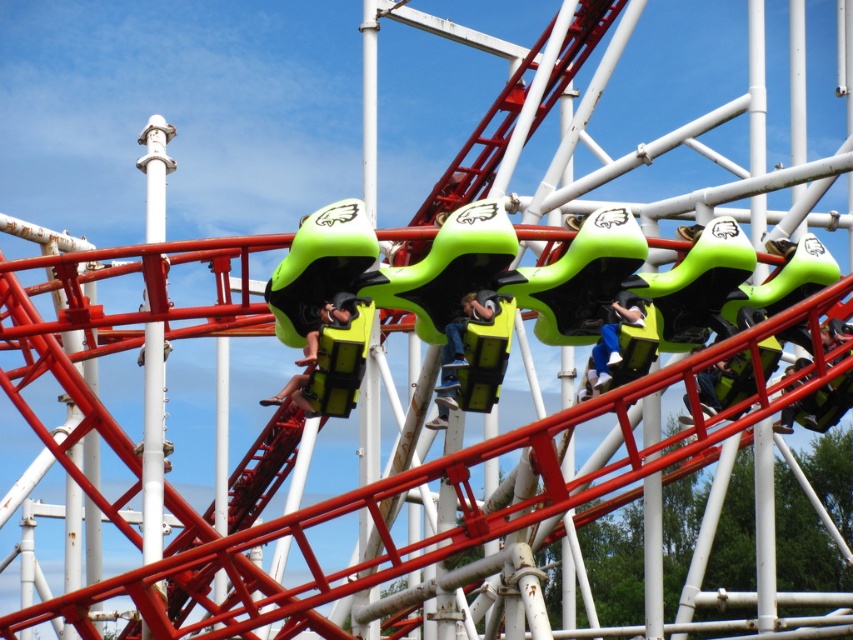
Can you confirm if green matte seat at center is shorter than yellow-green fabric safety vest at center?

In fact, green matte seat at center may be taller than yellow-green fabric safety vest at center.

Does green matte seat at center have a greater height compared to yellow-green fabric safety vest at center?

Yes, green matte seat at center is taller than yellow-green fabric safety vest at center.

Measure the distance between green matte seat at center and camera.

217.40 feet

Find the location of a particular element. green matte seat at center is located at coordinates (412, 282).

Consider the image. Is yellow-green plastic helmet at center positioned at the back of yellow-green fabric safety vest at center?

Yes.

Between yellow-green plastic helmet at center and yellow-green fabric safety vest at center, which one is positioned higher?

yellow-green plastic helmet at center is above.

Is point (451, 376) in front of point (326, 301)?

No, it is not.

Locate an element on the screen. yellow-green plastic helmet at center is located at coordinates (460, 349).

Which is more to the left, green matte seat at center or green matte helmet at center?

Positioned to the left is green matte seat at center.

At what (x,y) coordinates should I click in order to perform the action: click on green matte seat at center. Please return your answer as a coordinate pair (x, y). The width and height of the screenshot is (853, 640). Looking at the image, I should click on (412, 282).